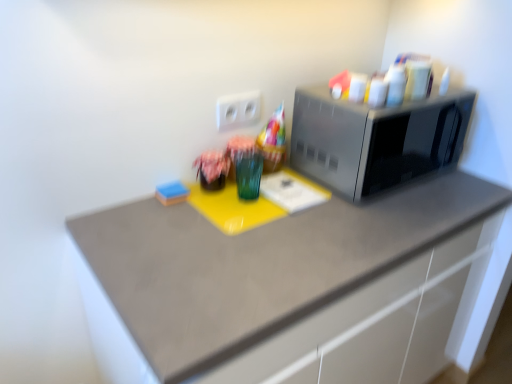
At what (x,y) coordinates should I click in order to perform the action: click on vacant space situated above matte gray countertop at center (from a real-world perspective). Please return your answer as a coordinate pair (x, y). This screenshot has height=384, width=512. Looking at the image, I should click on (277, 221).